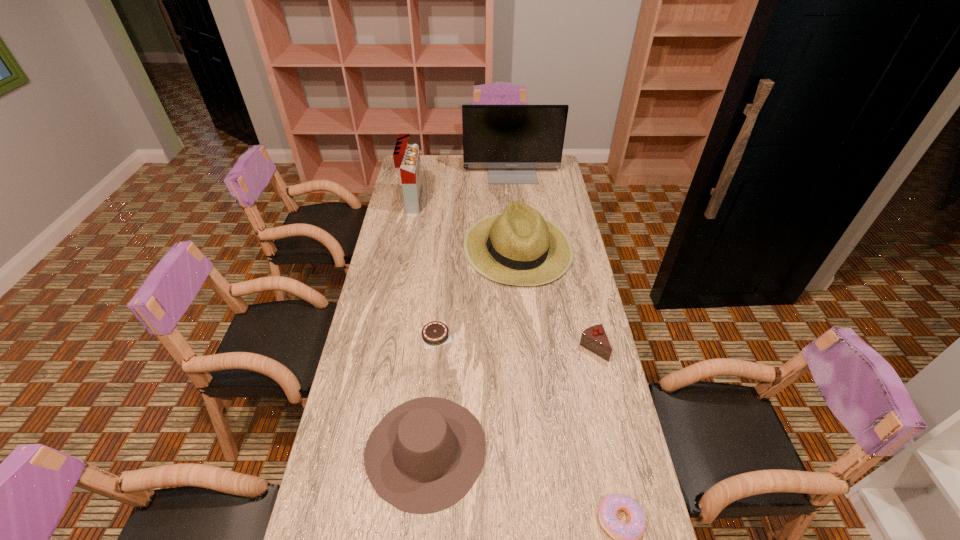
Locate an element on the screen. free space located on the front of the third tallest object is located at coordinates (529, 367).

This screenshot has width=960, height=540. I want to click on free space located on the right of the fourth tallest object, so click(558, 450).

Where is `free spot located on the front of the right chocolate cake`? This screenshot has width=960, height=540. free spot located on the front of the right chocolate cake is located at coordinates (607, 410).

Identify the location of free region located on the front of the shorter chocolate cake. (433, 362).

Locate an element on the screen. This screenshot has width=960, height=540. object located at the far edge is located at coordinates pos(511,141).

Locate an element on the screen. cigarette case located at the left edge is located at coordinates (406, 156).

At what (x,y) coordinates should I click in order to perform the action: click on cowboy hat present at the left edge. Please return your answer as a coordinate pair (x, y). Looking at the image, I should click on (424, 456).

What are the coordinates of `computer monitor present at the right edge` in the screenshot? It's located at (511, 141).

Find the location of a particular element. Image resolution: width=960 pixels, height=540 pixels. sunhat at the right edge is located at coordinates (520, 247).

Locate an element on the screen. chocolate cake that is at the right edge is located at coordinates (594, 338).